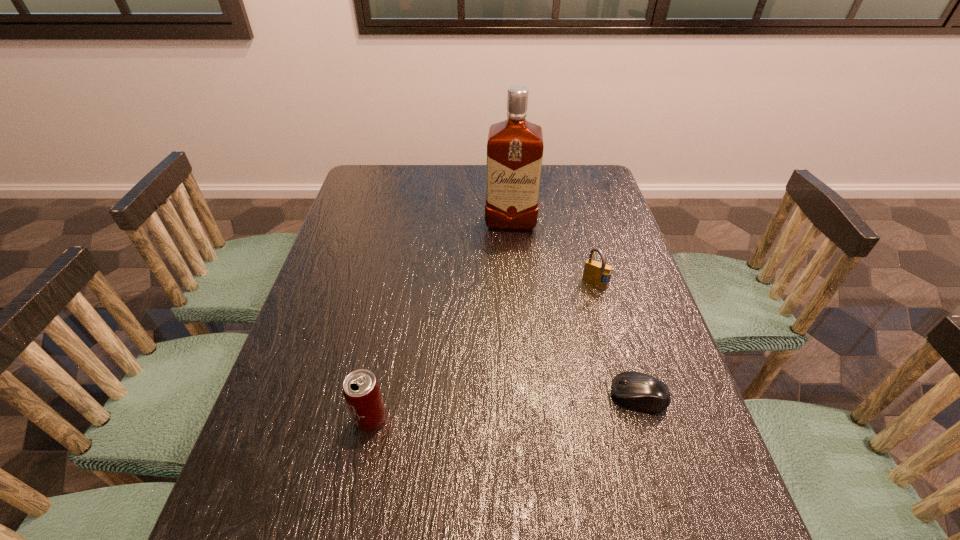
The height and width of the screenshot is (540, 960). What are the coordinates of `beer can` in the screenshot? It's located at (361, 390).

Where is `the shortest object`? The image size is (960, 540). the shortest object is located at coordinates (638, 390).

Identify the location of padlock. Image resolution: width=960 pixels, height=540 pixels. (595, 272).

The height and width of the screenshot is (540, 960). I want to click on the second object from left to right, so click(x=515, y=146).

I want to click on liquor, so click(x=515, y=146).

You are a GUI agent. You are given a task and a screenshot of the screen. Output one action in this format:
    pyautogui.click(x=<x>, y=<y>)
    Task: Click on the free space located on the back of the beer can
    
    Given the screenshot: What is the action you would take?
    pyautogui.click(x=380, y=369)

Image resolution: width=960 pixels, height=540 pixels. I want to click on vacant space located 0.090m on the back of the shortest object, so click(623, 347).

Identify the location of vacant space located on the side with the combination dials of the padlock. The image size is (960, 540). (542, 403).

Locate an element on the screen. This screenshot has height=540, width=960. vacant space located on the side with the combination dials of the padlock is located at coordinates (555, 375).

Find the location of a particular element. free space located on the side with the combination dials of the padlock is located at coordinates (544, 400).